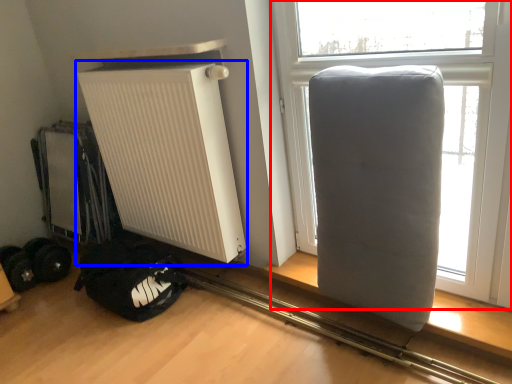
Question: Which of the following is the farthest to the observer, window (highlighted by a red box) or radiator (highlighted by a blue box)?

Choices:
 (A) window
 (B) radiator

Answer: (B)